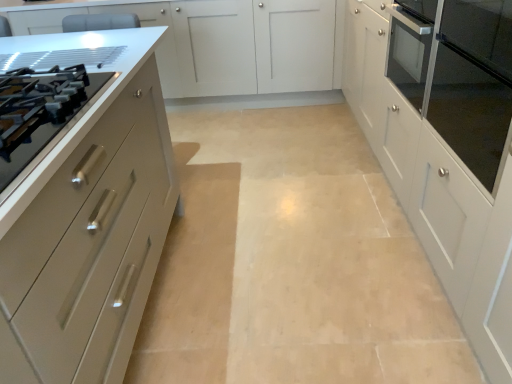
Question: Based on their sizes in the image, would you say matte beige cabinet at left, acting as the first cabinetry starting from the left, is bigger or smaller than white glossy cabinet at right, the 1th cabinetry when ordered from right to left?

Choices:
 (A) small
 (B) big

Answer: (B)

Question: In terms of width, does matte beige cabinet at left, acting as the first cabinetry starting from the left, look wider or thinner when compared to white glossy cabinet at right, the 1th cabinetry when ordered from right to left?

Choices:
 (A) wide
 (B) thin

Answer: (A)

Question: Considering the real-world distances, which object is closest to the matte white cabinet at center, which is the second cabinetry from right to left?

Choices:
 (A) matte beige cabinet at left, acting as the first cabinetry starting from the left
 (B) satin silver drawer at left
 (C) white glossy cabinet at right, the 1th cabinetry when ordered from right to left
 (D) matte glass oven door at right

Answer: (C)

Question: Estimate the real-world distances between objects in this image. Which object is closer to the matte beige cabinet at left, acting as the first cabinetry starting from the left?

Choices:
 (A) matte glass oven door at right
 (B) white glossy cabinet at right, placed as the third cabinetry when sorted from left to right
 (C) matte white cabinet at center, which is the second cabinetry from right to left
 (D) satin silver drawer at left

Answer: (D)